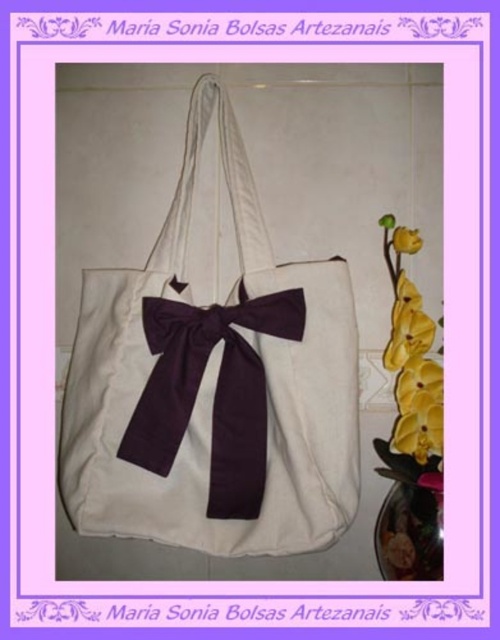
Question: Can you confirm if white canvas tote at center is bigger than yellow fabric flower at right?

Choices:
 (A) no
 (B) yes

Answer: (B)

Question: Which is farther from the purple satin bow at center?

Choices:
 (A) yellow matte flower at upper right
 (B) yellow fabric flower at right
 (C) white canvas tote at center

Answer: (A)

Question: In this image, where is matte glass vase at lower right located relative to yellow matte flower at upper right?

Choices:
 (A) left
 (B) right

Answer: (A)

Question: Which point is farther to the camera?

Choices:
 (A) (408, 250)
 (B) (400, 253)
 (C) (165, 387)
 (D) (293, 385)

Answer: (B)

Question: Which of the following is the closest to the observer?

Choices:
 (A) matte glass vase at lower right
 (B) white canvas tote at center

Answer: (B)

Question: Can you confirm if matte glass vase at lower right is wider than yellow matte flower at upper right?

Choices:
 (A) no
 (B) yes

Answer: (B)